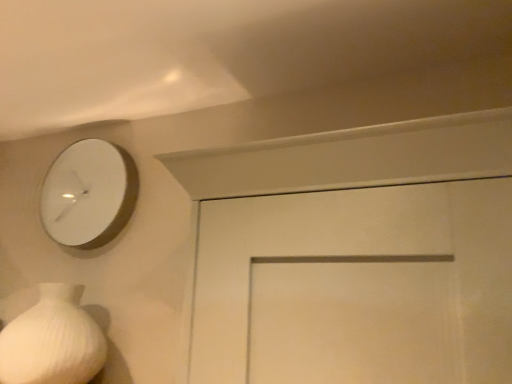
Question: From a real-world perspective, is white ribbed vase at lower left above or below white matte clock at upper left?

Choices:
 (A) below
 (B) above

Answer: (A)

Question: Is white ribbed vase at lower left wider or thinner than white matte clock at upper left?

Choices:
 (A) wide
 (B) thin

Answer: (A)

Question: Is white ribbed vase at lower left spatially inside white matte clock at upper left, or outside of it?

Choices:
 (A) outside
 (B) inside

Answer: (A)

Question: In terms of size, does white matte clock at upper left appear bigger or smaller than white ribbed vase at lower left?

Choices:
 (A) small
 (B) big

Answer: (A)

Question: Is white matte clock at upper left wider or thinner than white ribbed vase at lower left?

Choices:
 (A) thin
 (B) wide

Answer: (A)

Question: From the image's perspective, is white matte clock at upper left positioned above or below white ribbed vase at lower left?

Choices:
 (A) below
 (B) above

Answer: (B)

Question: Based on their positions, is white matte clock at upper left located to the left or right of white ribbed vase at lower left?

Choices:
 (A) left
 (B) right

Answer: (B)